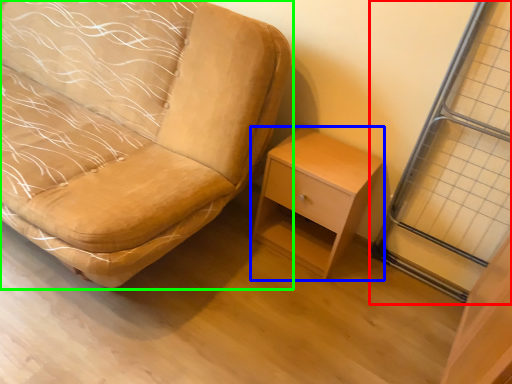
Question: Which object is the closest to the screen door (highlighted by a red box)? Choose among these: nightstand (highlighted by a blue box) or chair (highlighted by a green box).

Choices:
 (A) nightstand
 (B) chair

Answer: (A)